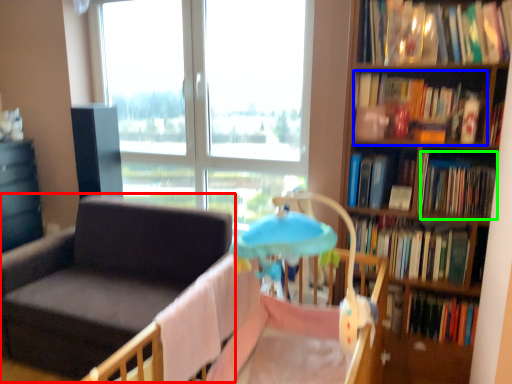
Question: Which object is positioned farthest from chair (highlighted by a red box)? Select from book (highlighted by a blue box) and book (highlighted by a green box).

Choices:
 (A) book
 (B) book

Answer: (B)